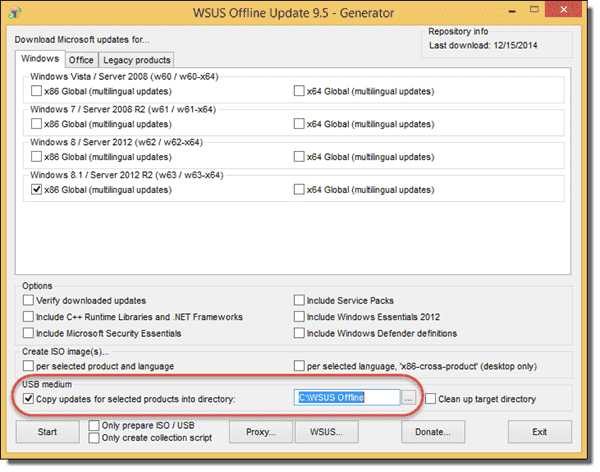
Identify the location of exit button. Image resolution: width=600 pixels, height=472 pixels. (536, 437).